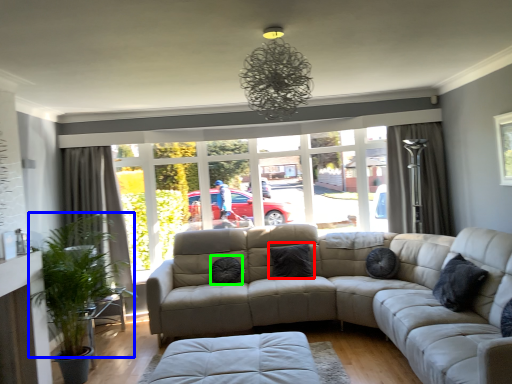
Question: Considering the real-world distances, which object is closest to pillow (highlighted by a red box)? plant (highlighted by a blue box) or pillow (highlighted by a green box).

Choices:
 (A) plant
 (B) pillow

Answer: (B)